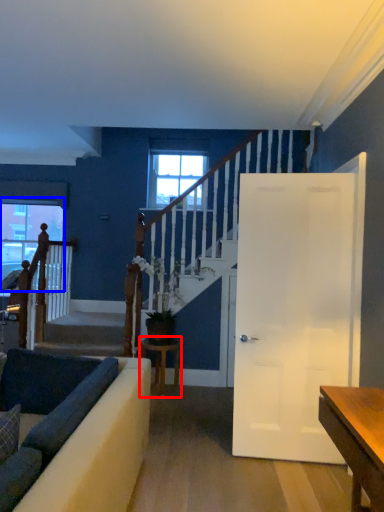
Question: Which point is closer to the camera, table (highlighted by a red box) or window (highlighted by a blue box)?

Choices:
 (A) table
 (B) window

Answer: (A)